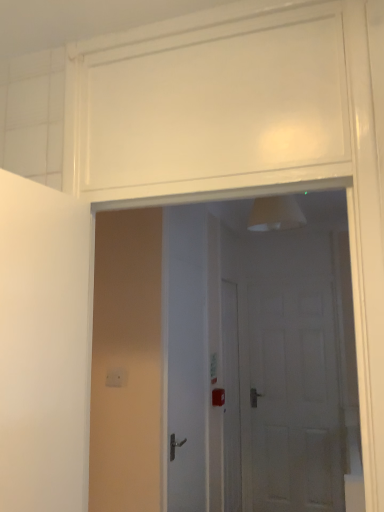
Question: Relative to white glossy door at center, which is the second door in back-to-front order, is white matte door at center, placed as the third door when sorted from left to right, in front or behind?

Choices:
 (A) behind
 (B) front

Answer: (A)

Question: From their relative heights in the image, would you say white matte door at center, which is counted as the 3th door, starting from the front, is taller or shorter than white glossy door at center, which is the 2th door from left to right?

Choices:
 (A) tall
 (B) short

Answer: (A)

Question: Estimate the real-world distances between objects in this image. Which object is farther from the white matte door at center, which is counted as the 3th door, starting from the front?

Choices:
 (A) white glossy door at center, the 3th door positioned from the right
 (B) white glossy door at center, which is the 2th door from left to right

Answer: (B)

Question: Which is nearer to the white matte door at center, which is counted as the 1th door, starting from the right?

Choices:
 (A) white glossy door at center, marked as the 2th door in a front-to-back arrangement
 (B) white glossy door at center, which appears as the 1th door when viewed from the left

Answer: (B)